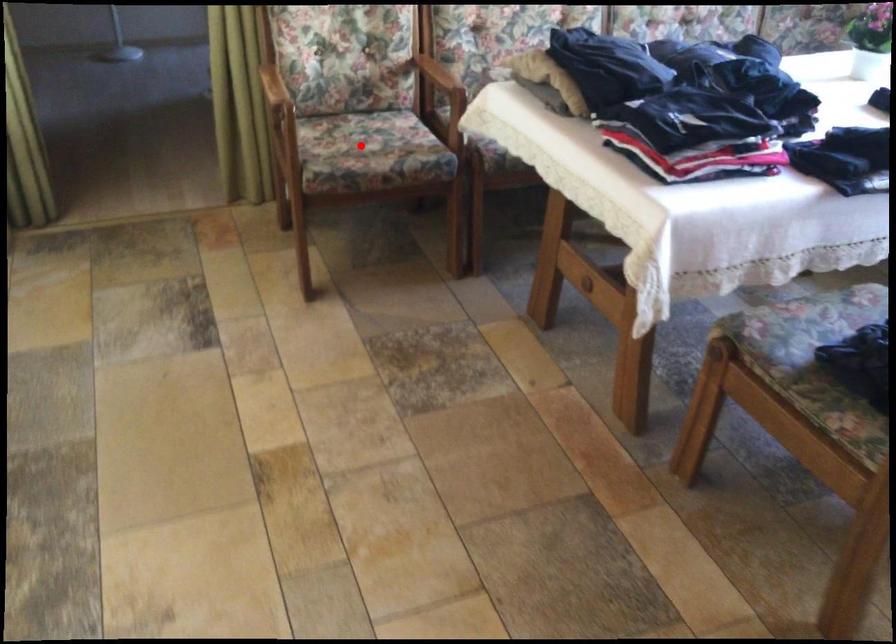
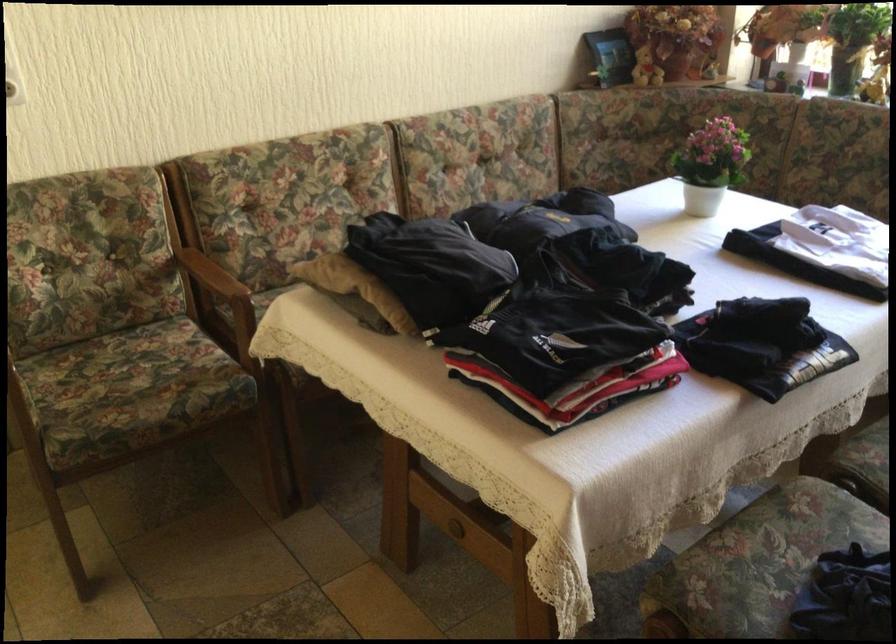
Where in the second image is the point corresponding to the highlighted location from the first image?

(130, 383)